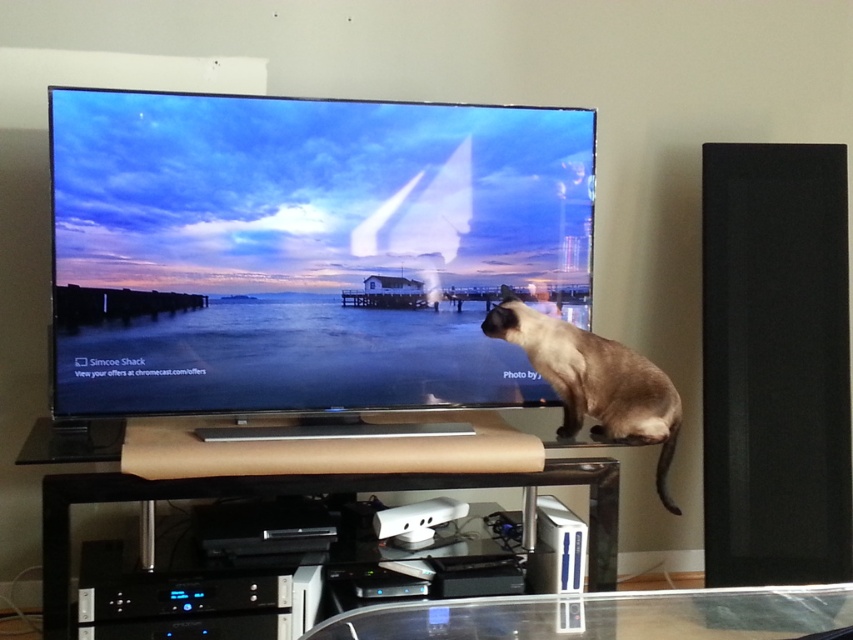
You are a delivery person who needs to place a 30 inch wide package on the transparent glass table at lower center or the transparent glass entertainment center at lower center. Which surface can accommodate the package without it hanging over the edge?

The transparent glass table at lower center and transparent glass entertainment center at lower center are 29.60 inches apart. Since the package is 30 inches wide, neither surface can fit it without overhanging because both are smaller than 30 inches in width.

You are a cat owner who wants to place a new 12 inch wide cat toy on the transparent glass table at lower center. Given the smokey brown fur at upper right is already on the table, will the toy fit without overlapping?

The transparent glass table at lower center is wider than the smokey brown fur at upper right. Since the table is wider, there should be enough space to place the 12 inch wide cat toy without overlapping the smokey brown fur at upper right.